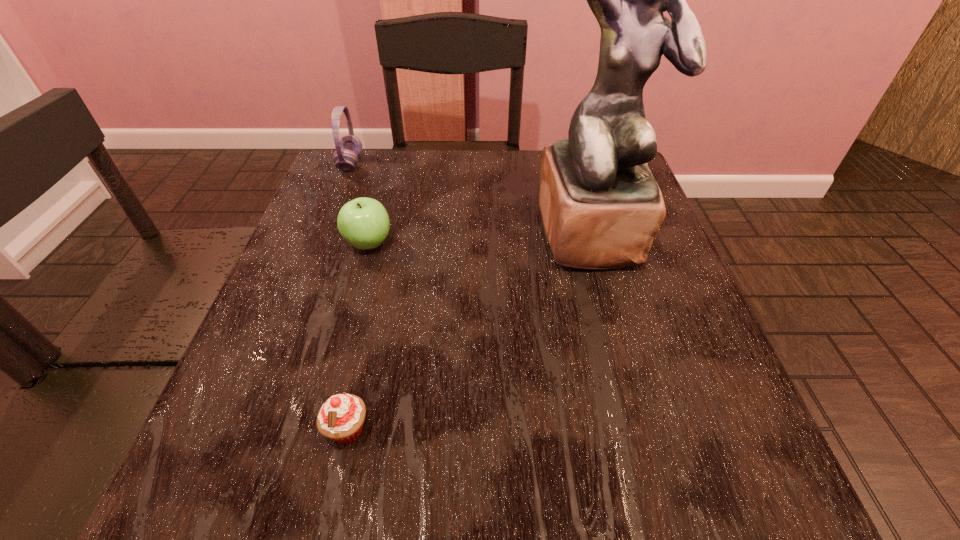
Locate an element on the screen. The width and height of the screenshot is (960, 540). object positioned at the far right corner is located at coordinates (601, 207).

What are the coordinates of `free location at the far edge` in the screenshot? It's located at (456, 150).

Image resolution: width=960 pixels, height=540 pixels. In the image, there is a desktop. In order to click on vacant space at the near edge in this screenshot , I will do `click(607, 482)`.

Locate an element on the screen. vacant space at the left edge is located at coordinates (317, 343).

Identify the location of vacant space at the right edge of the desktop. Image resolution: width=960 pixels, height=540 pixels. (678, 306).

I want to click on vacant space at the far left corner of the desktop, so click(x=365, y=171).

The image size is (960, 540). In order to click on vacant space at the near right corner of the desktop in this screenshot , I will do `click(694, 482)`.

Find the location of a particular element. The height and width of the screenshot is (540, 960). free spot between the shortest object and the sculpture is located at coordinates (469, 330).

Find the location of a particular element. Image resolution: width=960 pixels, height=540 pixels. free space between the second tallest object and the sculpture is located at coordinates (471, 198).

Image resolution: width=960 pixels, height=540 pixels. I want to click on vacant space that is in between the tallest object and the third shortest object, so click(x=471, y=198).